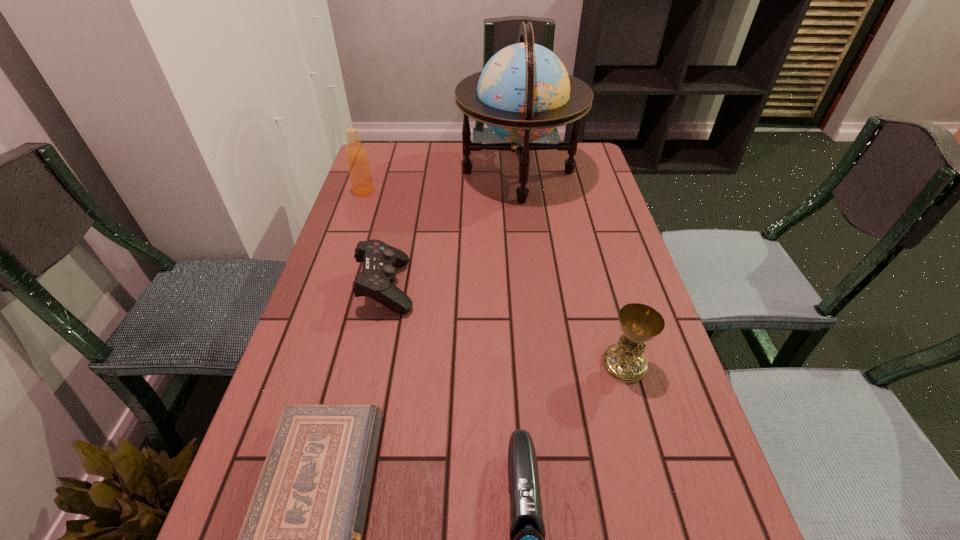
Where is `the tallest object`? This screenshot has width=960, height=540. the tallest object is located at coordinates (524, 92).

Locate an element on the screen. This screenshot has height=540, width=960. beer bottle is located at coordinates (356, 155).

Find the location of a particular element. The height and width of the screenshot is (540, 960). chalice is located at coordinates (624, 361).

Locate an element on the screen. This screenshot has height=540, width=960. the fourth shortest object is located at coordinates pos(624,361).

The image size is (960, 540). What are the coordinates of `control` in the screenshot? It's located at (378, 275).

Locate an element on the screen. The image size is (960, 540). the third shortest object is located at coordinates (378, 275).

Where is `vacant position located 0.230m on the surface of the globe`? Image resolution: width=960 pixels, height=540 pixels. vacant position located 0.230m on the surface of the globe is located at coordinates click(x=390, y=172).

The image size is (960, 540). What are the coordinates of `vacant space located 0.060m on the surface of the globe` in the screenshot? It's located at (440, 172).

You are a GUI agent. You are given a task and a screenshot of the screen. Output one action in this format:
    pyautogui.click(x=<x>, y=<y>)
    Task: Click on the vacant space located on the surface of the globe
    Image resolution: width=960 pixels, height=540 pixels.
    Given the screenshot: What is the action you would take?
    pyautogui.click(x=367, y=172)

Find the location of a particular element. This screenshot has height=540, width=960. free space located on the back of the beer bottle is located at coordinates (371, 171).